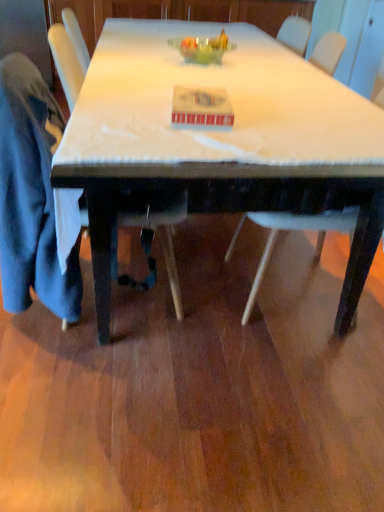
The height and width of the screenshot is (512, 384). Find the location of `vacant area that is situated to the right of translucent glass bowl at center`. vacant area that is situated to the right of translucent glass bowl at center is located at coordinates (259, 67).